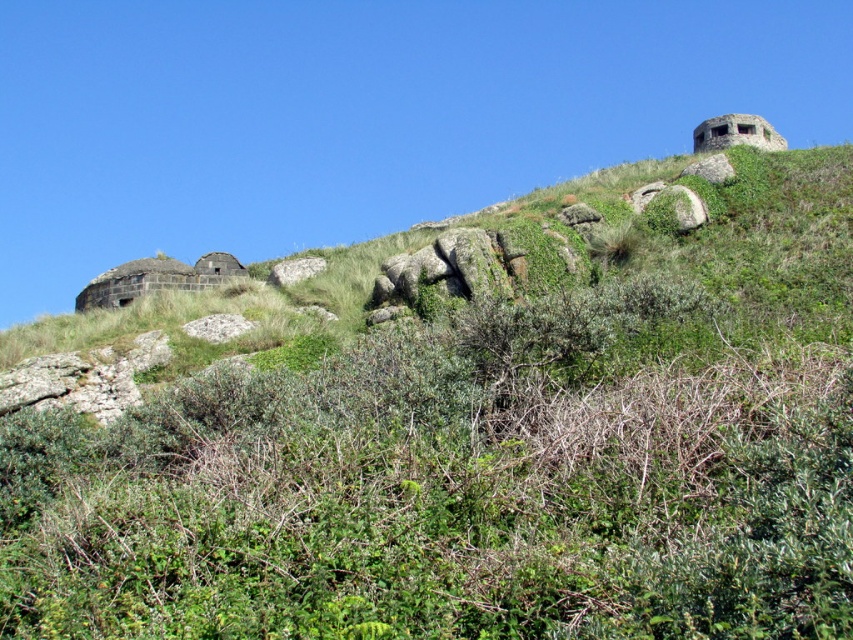
Looking at this image, is green leafy shrubs at upper center above rustic stone fort at upper left?

Actually, green leafy shrubs at upper center is below rustic stone fort at upper left.

Who is higher up, green leafy shrubs at upper center or rustic stone fort at upper left?

rustic stone fort at upper left is above.

Identify the location of green leafy shrubs at upper center. (451, 490).

Which is below, green leafy shrubs at upper center or brick-like concrete fort at upper right?

Positioned lower is green leafy shrubs at upper center.

What do you see at coordinates (451, 490) in the screenshot? Image resolution: width=853 pixels, height=640 pixels. I see `green leafy shrubs at upper center` at bounding box center [451, 490].

Identify the location of green leafy shrubs at upper center. Image resolution: width=853 pixels, height=640 pixels. (451, 490).

Is rustic stone fort at upper left to the right of brick-like concrete fort at upper right from the viewer's perspective?

No, rustic stone fort at upper left is not to the right of brick-like concrete fort at upper right.

Between point (200, 266) and point (744, 134), which one is positioned in front?

Point (200, 266)

Locate an element on the screen. This screenshot has height=640, width=853. rustic stone fort at upper left is located at coordinates (157, 278).